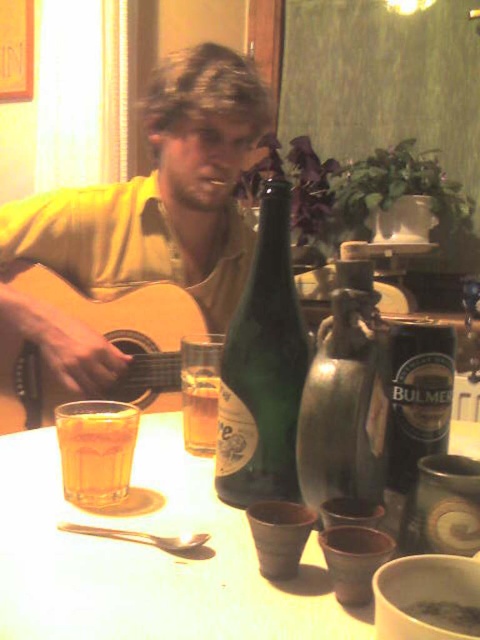
Question: In this image, where is translucent glass at table left located relative to translucent glass beer at center?

Choices:
 (A) left
 (B) right

Answer: (A)

Question: Is metallic silver jug at center below translucent glass beer at center?

Choices:
 (A) no
 (B) yes

Answer: (A)

Question: Which of the following is the closest to the observer?

Choices:
 (A) (289, 291)
 (B) (201, 412)
 (C) (180, 300)
 (D) (70, 627)

Answer: (D)

Question: Does matte glass cup at lower left have a smaller size compared to metallic silver jug at center?

Choices:
 (A) no
 (B) yes

Answer: (A)

Question: Estimate the real-world distances between objects in this image. Which object is closer to the matte yellow shirt at upper left?

Choices:
 (A) metallic silver jug at center
 (B) matte wood guitar at left
 (C) matte glass cup at lower left

Answer: (B)

Question: Which object is closer to the camera taking this photo?

Choices:
 (A) green glass bottle at center
 (B) matte yellow shirt at upper left
 (C) translucent glass beer at center
 (D) metallic silver jug at center

Answer: (D)